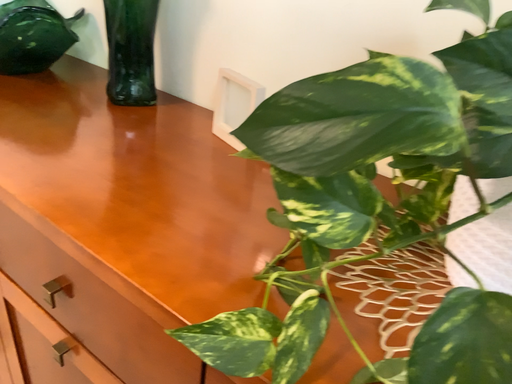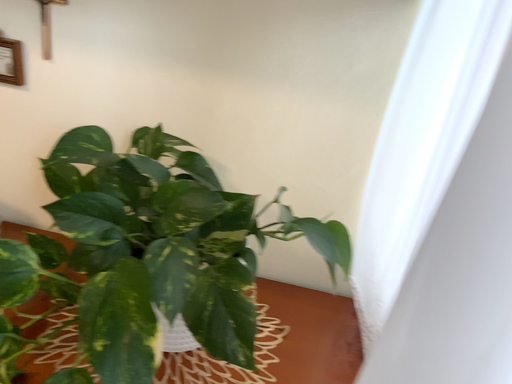
Question: Which way did the camera rotate in the video?

Choices:
 (A) rotated right
 (B) rotated left

Answer: (A)